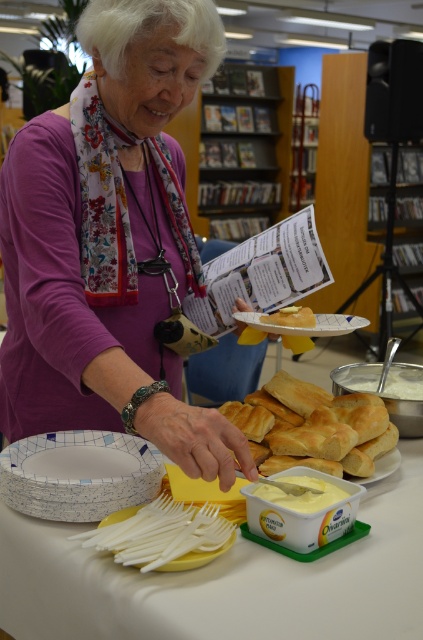
Between white plastic table at center and white paper plate at lower left, which one is positioned lower?

white plastic table at center

The width and height of the screenshot is (423, 640). Find the location of `white plastic table at center`. white plastic table at center is located at coordinates (224, 580).

Is point (299, 627) behind point (109, 496)?

No, it is not.

You are a GUI agent. You are given a task and a screenshot of the screen. Output one action in this format:
    pyautogui.click(x=<x>, y=<y>)
    Task: Click on the white plastic table at center
    The height and width of the screenshot is (640, 423).
    Given the screenshot: What is the action you would take?
    pyautogui.click(x=224, y=580)

Describe the element at coordinates (224, 580) in the screenshot. I see `white plastic table at center` at that location.

Does white plastic table at center have a lesser height compared to yellow creamy spread at center?

In fact, white plastic table at center may be taller than yellow creamy spread at center.

Which is behind, point (409, 589) or point (279, 504)?

The point (279, 504) is behind.

Locate an element on the screen. white plastic table at center is located at coordinates (224, 580).

Which is more to the right, white plastic table at center or white creamy spread at center?

From the viewer's perspective, white creamy spread at center appears more on the right side.

Which of these two, white plastic table at center or white creamy spread at center, stands taller?

Standing taller between the two is white plastic table at center.

The height and width of the screenshot is (640, 423). Identify the location of white plastic table at center. (224, 580).

The width and height of the screenshot is (423, 640). Find the location of `white plastic table at center`. white plastic table at center is located at coordinates [x=224, y=580].